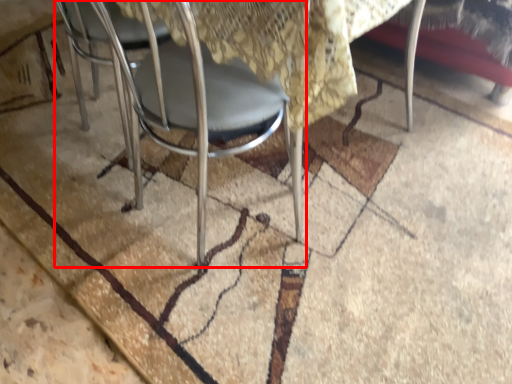
Question: From the image, what is the correct spatial relationship of chair (annotated by the red box) in relation to mat?

Choices:
 (A) right
 (B) left

Answer: (A)